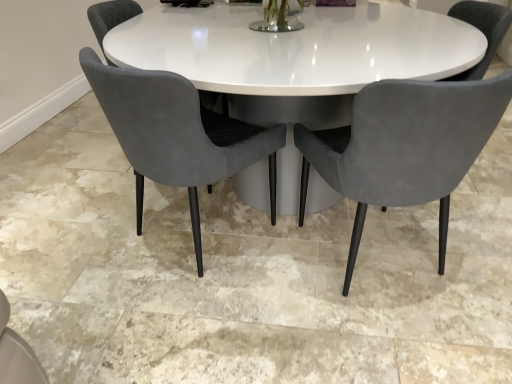
At what (x,y) coordinates should I click in order to perform the action: click on velvet grey chair at center, the 2th chair when ordered from left to right. Please return your answer as a coordinate pair (x, y). Image resolution: width=512 pixels, height=384 pixels. Looking at the image, I should click on (169, 132).

Identify the location of velvet grey chair at center, the 1th chair positioned from the left. Image resolution: width=512 pixels, height=384 pixels. (110, 18).

From the image's perspective, is velvet grey chair at center, the 3th chair positioned from the left, located above or below velvet grey chair at center, the 1th chair positioned from the left?

velvet grey chair at center, the 3th chair positioned from the left, is below velvet grey chair at center, the 1th chair positioned from the left.

Which is less distant, [452,163] or [106,26]?

Point [452,163].

Is velvet grey chair at center, the 3th chair positioned from the left, outside of velvet grey chair at center, arranged as the 3th chair when viewed from the right?

velvet grey chair at center, the 3th chair positioned from the left, lies outside velvet grey chair at center, arranged as the 3th chair when viewed from the right,'s area.

Which object is positioned more to the left, velvet grey chair at center, the 3th chair positioned from the left, or velvet grey chair at center, the 1th chair positioned from the left?

Positioned to the left is velvet grey chair at center, the 1th chair positioned from the left.

Is velvet grey chair at center, arranged as the 3th chair when viewed from the right, in front of or behind velvet grey chair at center, which is counted as the 1th chair, starting from the right, in the image?

velvet grey chair at center, arranged as the 3th chair when viewed from the right, is positioned farther from the viewer than velvet grey chair at center, which is counted as the 1th chair, starting from the right.

Does velvet grey chair at center, arranged as the 3th chair when viewed from the right, appear on the left side of velvet grey chair at center, which is counted as the 1th chair, starting from the right?

Yes.

Looking at this image, is velvet grey chair at center, arranged as the 3th chair when viewed from the right, thinner than velvet grey chair at center, the 3th chair positioned from the left?

Correct, the width of velvet grey chair at center, arranged as the 3th chair when viewed from the right, is less than that of velvet grey chair at center, the 3th chair positioned from the left.

From the image's perspective, which one is positioned higher, velvet grey chair at center, arranged as the 3th chair when viewed from the right, or velvet grey chair at center, which is counted as the 1th chair, starting from the right?

velvet grey chair at center, arranged as the 3th chair when viewed from the right, appears higher in the image.

Is velvet grey chair at center, the 3th chair positioned from the left, oriented towards velvet grey chair at center, which ranks as the second chair in right-to-left order?

No, velvet grey chair at center, the 3th chair positioned from the left, is not turned towards velvet grey chair at center, which ranks as the second chair in right-to-left order.

Which is closer, (425, 199) or (173, 79)?

The point (173, 79) is closer.

Can you tell me how much velvet grey chair at center, the 3th chair positioned from the left, and velvet grey chair at center, the 2th chair when ordered from left to right, differ in facing direction?

The facing directions of velvet grey chair at center, the 3th chair positioned from the left, and velvet grey chair at center, the 2th chair when ordered from left to right, are 50.8 degrees apart.

Based on their positions, is velvet grey chair at center, the 1th chair positioned from the left, located to the left or right of velvet grey chair at center, which ranks as the second chair in right-to-left order?

Clearly, velvet grey chair at center, the 1th chair positioned from the left, is on the left of velvet grey chair at center, which ranks as the second chair in right-to-left order, in the image.

Is velvet grey chair at center, which ranks as the second chair in right-to-left order, surrounded by velvet grey chair at center, arranged as the 3th chair when viewed from the right?

Definitely not — velvet grey chair at center, which ranks as the second chair in right-to-left order, is not inside velvet grey chair at center, arranged as the 3th chair when viewed from the right.

From a real-world perspective, is velvet grey chair at center, the 1th chair positioned from the left, beneath velvet grey chair at center, which ranks as the second chair in right-to-left order?

No.

Does velvet grey chair at center, the 1th chair positioned from the left, have a larger size compared to velvet grey chair at center, which ranks as the second chair in right-to-left order?

Indeed, velvet grey chair at center, the 1th chair positioned from the left, has a larger size compared to velvet grey chair at center, which ranks as the second chair in right-to-left order.

Between velvet grey chair at center, the 2th chair when ordered from left to right, and velvet grey chair at center, the 1th chair positioned from the left, which one has more height?

With more height is velvet grey chair at center, the 2th chair when ordered from left to right.

From a real-world perspective, is velvet grey chair at center, the 2th chair when ordered from left to right, located higher than velvet grey chair at center, arranged as the 3th chair when viewed from the right?

No, from a real-world perspective, velvet grey chair at center, the 2th chair when ordered from left to right, is not above velvet grey chair at center, arranged as the 3th chair when viewed from the right.

Is point (174, 167) positioned in front of point (224, 108)?

Yes, it is.

Considering their positions, is velvet grey chair at center, which ranks as the second chair in right-to-left order, located in front of or behind velvet grey chair at center, which is counted as the 1th chair, starting from the right?

velvet grey chair at center, which ranks as the second chair in right-to-left order, is behind velvet grey chair at center, which is counted as the 1th chair, starting from the right.

This screenshot has height=384, width=512. In the image, there is a velvet grey chair at center, the 2th chair when ordered from left to right. Identify the location of chair below it (from the image's perspective). (404, 146).

Is velvet grey chair at center, which ranks as the second chair in right-to-left order, oriented towards velvet grey chair at center, which is counted as the 1th chair, starting from the right?

No, velvet grey chair at center, which ranks as the second chair in right-to-left order, does not turn towards velvet grey chair at center, which is counted as the 1th chair, starting from the right.

Find the location of a particular element. chair that is the 2nd one when counting upward from the velvet grey chair at center, the 3th chair positioned from the left (from the image's perspective) is located at coordinates (110, 18).

At what (x,y) coordinates should I click in order to perform the action: click on the 2nd chair in front of the velvet grey chair at center, arranged as the 3th chair when viewed from the right, starting your count from the anchor. Please return your answer as a coordinate pair (x, y). Looking at the image, I should click on (404, 146).

From the image, which object appears to be nearer to velvet grey chair at center, the 2th chair when ordered from left to right, velvet grey chair at center, arranged as the 3th chair when viewed from the right, or velvet grey chair at center, the 3th chair positioned from the left?

The object closer to velvet grey chair at center, the 2th chair when ordered from left to right, is velvet grey chair at center, the 3th chair positioned from the left.

Which object lies further to the anchor point velvet grey chair at center, which is counted as the 1th chair, starting from the right, velvet grey chair at center, the 2th chair when ordered from left to right, or velvet grey chair at center, arranged as the 3th chair when viewed from the right?

velvet grey chair at center, arranged as the 3th chair when viewed from the right, is further to velvet grey chair at center, which is counted as the 1th chair, starting from the right.

Based on their spatial positions, is velvet grey chair at center, which is counted as the 1th chair, starting from the right, or velvet grey chair at center, the 1th chair positioned from the left, closer to velvet grey chair at center, which ranks as the second chair in right-to-left order?

velvet grey chair at center, which is counted as the 1th chair, starting from the right, lies closer to velvet grey chair at center, which ranks as the second chair in right-to-left order, than the other object.

Looking at the image, which one is located closer to velvet grey chair at center, the 1th chair positioned from the left, velvet grey chair at center, the 2th chair when ordered from left to right, or velvet grey chair at center, the 3th chair positioned from the left?

velvet grey chair at center, the 2th chair when ordered from left to right, lies closer to velvet grey chair at center, the 1th chair positioned from the left, than the other object.

Which object lies further to the anchor point velvet grey chair at center, the 1th chair positioned from the left, velvet grey chair at center, the 3th chair positioned from the left, or velvet grey chair at center, the 2th chair when ordered from left to right?

velvet grey chair at center, the 3th chair positioned from the left, lies further to velvet grey chair at center, the 1th chair positioned from the left, than the other object.

Which object lies nearer to the anchor point velvet grey chair at center, the 3th chair positioned from the left, velvet grey chair at center, the 1th chair positioned from the left, or velvet grey chair at center, which ranks as the second chair in right-to-left order?

Based on the image, velvet grey chair at center, which ranks as the second chair in right-to-left order, appears to be nearer to velvet grey chair at center, the 3th chair positioned from the left.

Identify the location of chair between velvet grey chair at center, arranged as the 3th chair when viewed from the right, and velvet grey chair at center, the 3th chair positioned from the left, from left to right. (169, 132).